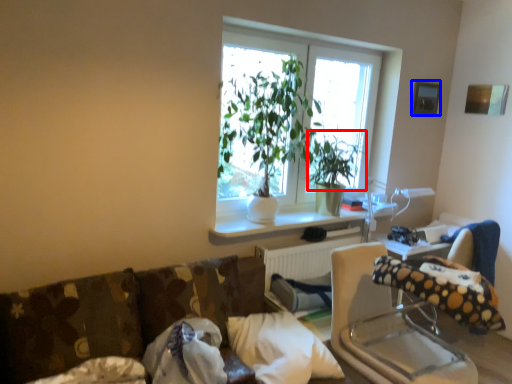
Question: Which object is further to the camera taking this photo, plant (highlighted by a red box) or picture frame (highlighted by a blue box)?

Choices:
 (A) plant
 (B) picture frame

Answer: (B)